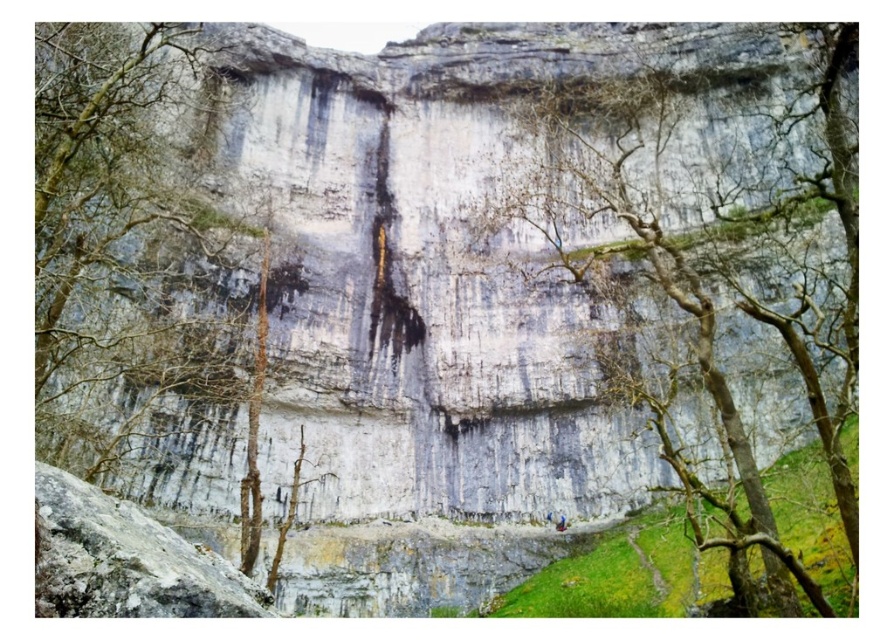
Question: Among these points, which one is nearest to the camera?

Choices:
 (A) (561, 518)
 (B) (627, 376)
 (C) (102, 570)

Answer: (C)

Question: Does green leafy tree at center lie behind gray rough rock at lower left?

Choices:
 (A) yes
 (B) no

Answer: (A)

Question: Which point is farther from the camera taking this photo?

Choices:
 (A) tap(121, 611)
 (B) tap(783, 577)
 (C) tap(171, 152)
 (D) tap(564, 516)

Answer: (C)

Question: Is green leafy tree at center to the right of gray rough rock at lower left from the viewer's perspective?

Choices:
 (A) no
 (B) yes

Answer: (A)

Question: Estimate the real-world distances between objects in this image. Which object is farther from the blue fabric person at lower center?

Choices:
 (A) gray rough rock at lower left
 (B) green leafy tree at center
 (C) bare branches at center

Answer: (B)

Question: Can you confirm if bare branches at center is positioned to the left of green leafy tree at center?

Choices:
 (A) yes
 (B) no

Answer: (B)